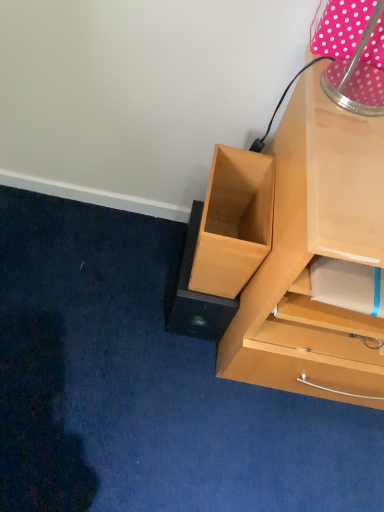
Question: Is brown cardboard drawer at lower left outside of pink polka dot fabric at upper right?

Choices:
 (A) no
 (B) yes

Answer: (B)

Question: Is brown cardboard drawer at lower left further to the viewer compared to pink polka dot fabric at upper right?

Choices:
 (A) yes
 (B) no

Answer: (A)

Question: Is pink polka dot fabric at upper right a part of brown cardboard drawer at lower left?

Choices:
 (A) no
 (B) yes

Answer: (A)

Question: Does brown cardboard drawer at lower left have a greater width compared to pink polka dot fabric at upper right?

Choices:
 (A) yes
 (B) no

Answer: (A)

Question: From the image's perspective, is brown cardboard drawer at lower left below pink polka dot fabric at upper right?

Choices:
 (A) yes
 (B) no

Answer: (A)

Question: Is brown cardboard drawer at lower left taller than pink polka dot fabric at upper right?

Choices:
 (A) yes
 (B) no

Answer: (A)

Question: Does pink polka dot fabric at upper right have a greater width compared to brown cardboard drawer at lower left?

Choices:
 (A) no
 (B) yes

Answer: (A)

Question: Is pink polka dot fabric at upper right outside of brown cardboard drawer at lower left?

Choices:
 (A) no
 (B) yes

Answer: (B)

Question: From a real-world perspective, is pink polka dot fabric at upper right positioned over brown cardboard drawer at lower left based on gravity?

Choices:
 (A) yes
 (B) no

Answer: (A)

Question: Is pink polka dot fabric at upper right looking in the opposite direction of brown cardboard drawer at lower left?

Choices:
 (A) no
 (B) yes

Answer: (A)

Question: Is pink polka dot fabric at upper right far away from brown cardboard drawer at lower left?

Choices:
 (A) yes
 (B) no

Answer: (B)

Question: From a real-world perspective, is pink polka dot fabric at upper right physically below brown cardboard drawer at lower left?

Choices:
 (A) no
 (B) yes

Answer: (A)

Question: Considering the positions of pink polka dot fabric at upper right and brown cardboard drawer at lower left in the image, is pink polka dot fabric at upper right wider or thinner than brown cardboard drawer at lower left?

Choices:
 (A) wide
 (B) thin

Answer: (B)